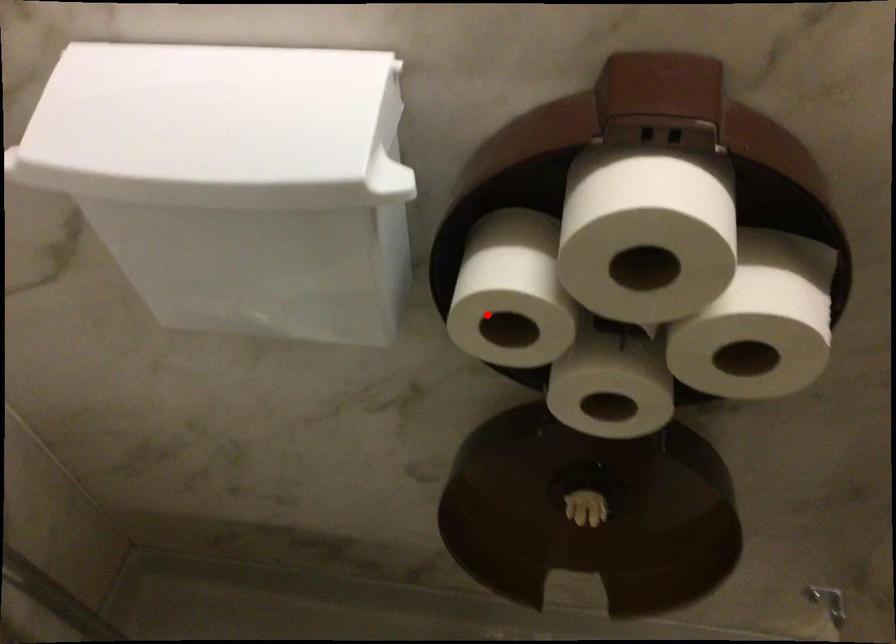
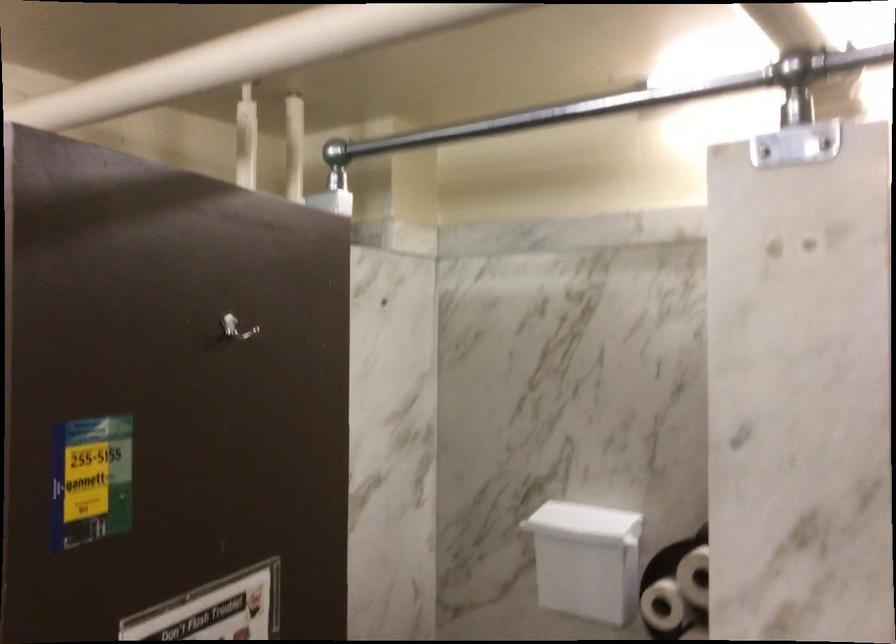
The point at the highlighted location is marked in the first image. Where is the corresponding point in the second image?

(662, 605)